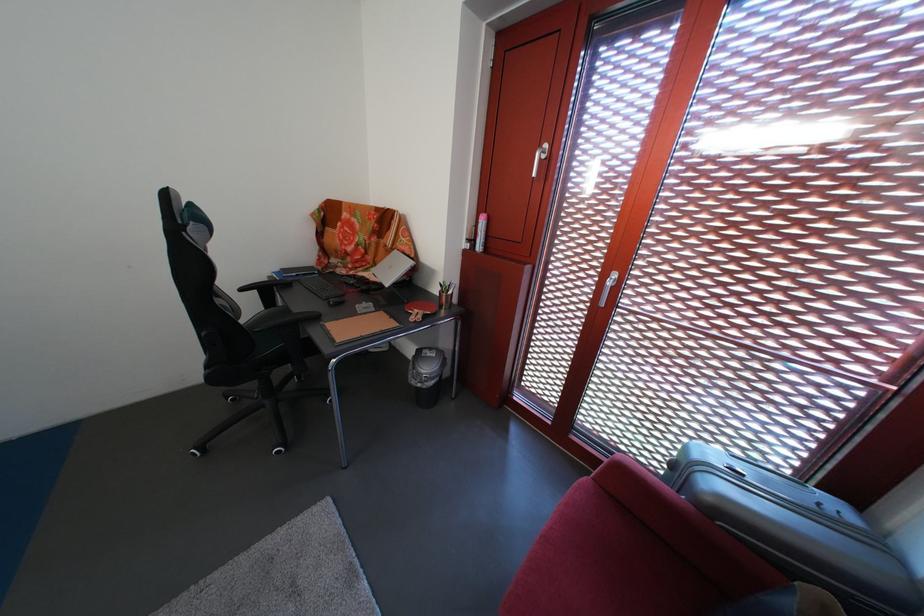
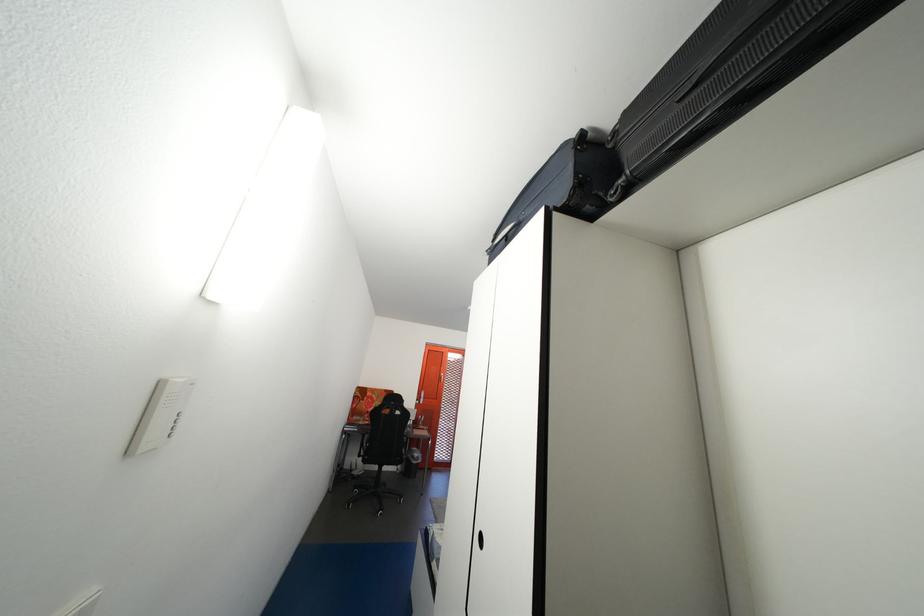
Question: I am providing you with two images of the same scene from different viewpoints. Which of the following objects are not visible in image2?

Choices:
 (A) plastic tissue package
 (B) orange door handle
 (C) black chair armrest
 (D) silver suitcase

Answer: (D)